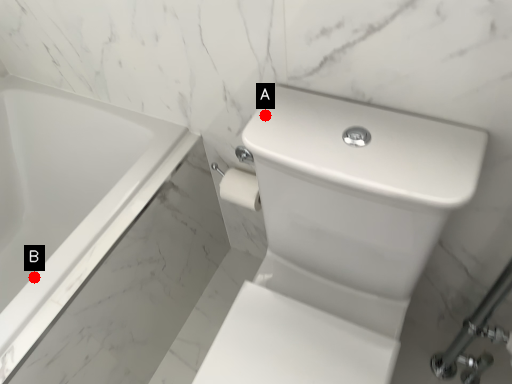
Question: Two points are circled on the image, labeled by A and B beside each circle. Which point is closer to the camera taking this photo?

Choices:
 (A) A is closer
 (B) B is closer

Answer: (A)